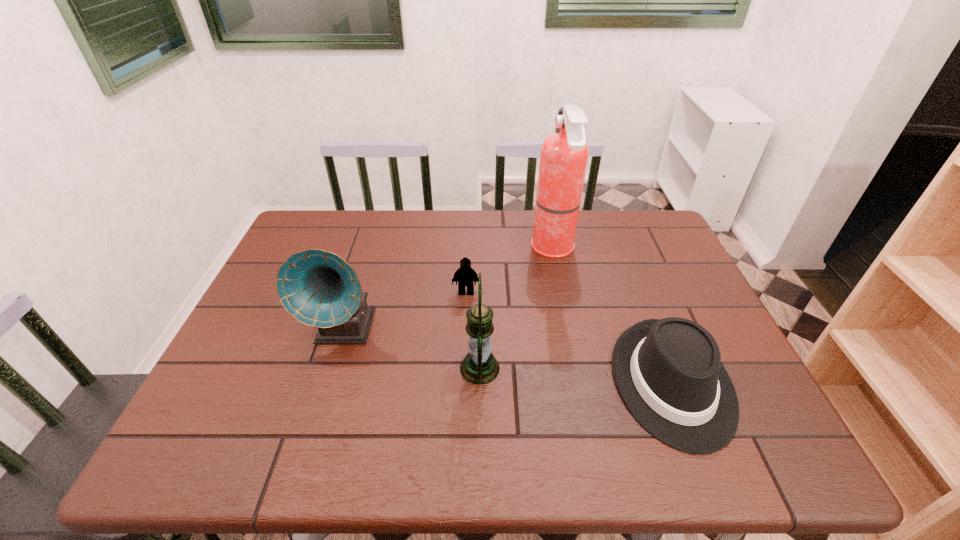
Image resolution: width=960 pixels, height=540 pixels. Identify the location of vacant space at the near left corner. (213, 455).

At what (x,y) coordinates should I click in order to perform the action: click on vacant space at the far right corner of the desktop. Please return your answer as a coordinate pair (x, y). The height and width of the screenshot is (540, 960). Looking at the image, I should click on (636, 215).

Find the location of `vacant area that lies between the rightmost object and the second object from right to left`. vacant area that lies between the rightmost object and the second object from right to left is located at coordinates (612, 315).

Find the location of `free space that is in between the phonograph_record and the lantern`. free space that is in between the phonograph_record and the lantern is located at coordinates (413, 348).

At what (x,y) coordinates should I click in order to perform the action: click on free spot between the Lego and the leftmost object. Please return your answer as a coordinate pair (x, y). Image resolution: width=960 pixels, height=540 pixels. Looking at the image, I should click on pyautogui.click(x=405, y=310).

I want to click on free point between the leftmost object and the fedora, so click(509, 356).

You are a GUI agent. You are given a task and a screenshot of the screen. Output one action in this format:
    pyautogui.click(x=<x>, y=<y>)
    Task: Click on the blank region between the phonograph_record and the tallest object
    
    Given the screenshot: What is the action you would take?
    pyautogui.click(x=449, y=288)

Locate an element on the screen. The width and height of the screenshot is (960, 540). vacant region between the fedora and the Lego is located at coordinates (569, 338).

This screenshot has width=960, height=540. Identify the location of unoccupied position between the lantern and the fedora. (576, 375).

You are a GUI agent. You are given a task and a screenshot of the screen. Output one action in this format:
    pyautogui.click(x=<x>, y=<y>)
    Task: Click on the free spot between the phonograph_record and the tallest object
    The image size is (960, 540).
    Given the screenshot: What is the action you would take?
    pyautogui.click(x=449, y=288)